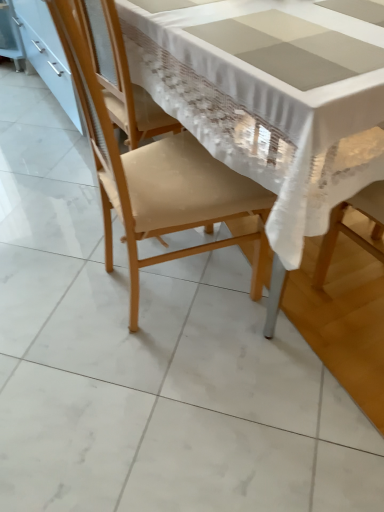
Find the location of a particular element. Image resolution: width=384 pixels, height=512 pixels. free location in front of white glossy cabinet at left is located at coordinates (43, 162).